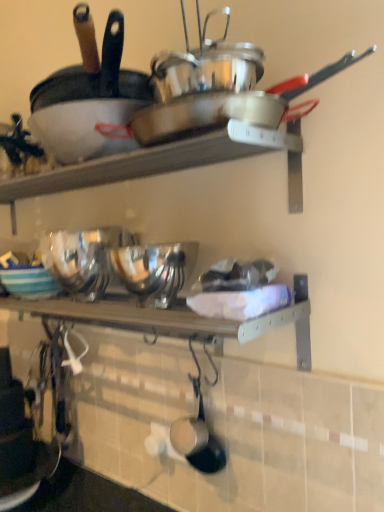
How much space does shiny silver frying pan at lower center, placed as the 2th frying pan when sorted from top to bottom, occupy horizontally?

shiny silver frying pan at lower center, placed as the 2th frying pan when sorted from top to bottom, is 2.37 inches wide.

Where is `shiny silver wok at upper center`? shiny silver wok at upper center is located at coordinates (217, 99).

Measure the distance between shiny silver wok at upper center and camera.

25.85 inches.

The height and width of the screenshot is (512, 384). In order to click on striped ceramic bowl at center in this screenshot , I will do click(29, 282).

Is wooden shelf at center bigger than matte black frying pan at upper left, arranged as the 2th frying pan when ordered from the bottom?

Incorrect, wooden shelf at center is not larger than matte black frying pan at upper left, arranged as the 2th frying pan when ordered from the bottom.

From a real-world perspective, is wooden shelf at center positioned above or below matte black frying pan at upper left, arranged as the 2th frying pan when ordered from the bottom?

wooden shelf at center is situated lower than matte black frying pan at upper left, arranged as the 2th frying pan when ordered from the bottom, in the real world.

Is the surface of wooden shelf at center in direct contact with matte black frying pan at upper left, the 1th frying pan from the top?

No.

How many degrees apart are the facing directions of wooden shelf at center and matte black frying pan at upper left, the 1th frying pan from the top?

2.65 degrees separate the facing orientations of wooden shelf at center and matte black frying pan at upper left, the 1th frying pan from the top.

Is striped ceramic bowl at center positioned with its back to shiny silver wok at upper center?

No, striped ceramic bowl at center's orientation is not away from shiny silver wok at upper center.

Do you think striped ceramic bowl at center is within shiny silver wok at upper center, or outside of it?

striped ceramic bowl at center exists outside the volume of shiny silver wok at upper center.

Are striped ceramic bowl at center and shiny silver wok at upper center making contact?

No, striped ceramic bowl at center is not beside shiny silver wok at upper center.

Image resolution: width=384 pixels, height=512 pixels. I want to click on wok that appears above the striped ceramic bowl at center (from the image's perspective), so click(x=217, y=99).

From the image's perspective, which one is positioned higher, shiny silver frying pan at lower center, placed as the 2th frying pan when sorted from top to bottom, or shiny silver wok at upper center?

shiny silver wok at upper center is shown above in the image.

How far apart are shiny silver frying pan at lower center, placed as the 2th frying pan when sorted from top to bottom, and shiny silver wok at upper center?

26.81 inches.

Consider the image. Looking at their sizes, would you say shiny silver frying pan at lower center, placed as the 2th frying pan when sorted from top to bottom, is wider or thinner than shiny silver wok at upper center?

In the image, shiny silver frying pan at lower center, placed as the 2th frying pan when sorted from top to bottom, appears to be more narrow than shiny silver wok at upper center.

How different are the orientations of shiny silver frying pan at lower center, the 1th frying pan ordered from the bottom, and shiny silver wok at upper center in degrees?

The angular difference between shiny silver frying pan at lower center, the 1th frying pan ordered from the bottom, and shiny silver wok at upper center is 3.93 degrees.

Which point is more forward, (28, 288) or (134, 310)?

Point (134, 310)

Would you consider striped ceramic bowl at center to be distant from wooden shelf at center?

Actually, striped ceramic bowl at center and wooden shelf at center are a little close together.

From a real-world perspective, who is located lower, striped ceramic bowl at center or wooden shelf at center?

In real-world perspective, wooden shelf at center is lower.

Locate an element on the screen. Image resolution: width=384 pixels, height=512 pixels. shelf below the striped ceramic bowl at center (from the image's perspective) is located at coordinates (171, 320).

Is wooden shelf at center facing towards shiny silver wok at upper center?

No, wooden shelf at center is not oriented towards shiny silver wok at upper center.

Is wooden shelf at center next to shiny silver wok at upper center?

No.

Considering the relative sizes of wooden shelf at center and shiny silver wok at upper center in the image provided, is wooden shelf at center smaller than shiny silver wok at upper center?

Yes, wooden shelf at center is smaller than shiny silver wok at upper center.

Is wooden shelf at center located outside shiny silver wok at upper center?

Indeed, wooden shelf at center is completely outside shiny silver wok at upper center.

Which is more to the right, shiny silver frying pan at lower center, placed as the 2th frying pan when sorted from top to bottom, or striped ceramic bowl at center?

shiny silver frying pan at lower center, placed as the 2th frying pan when sorted from top to bottom.

Considering the relative sizes of shiny silver frying pan at lower center, placed as the 2th frying pan when sorted from top to bottom, and striped ceramic bowl at center in the image provided, is shiny silver frying pan at lower center, placed as the 2th frying pan when sorted from top to bottom, bigger than striped ceramic bowl at center?

Incorrect, shiny silver frying pan at lower center, placed as the 2th frying pan when sorted from top to bottom, is not larger than striped ceramic bowl at center.

Can you confirm if shiny silver wok at upper center is taller than matte black frying pan at upper left, the 1th frying pan from the top?

Incorrect, the height of shiny silver wok at upper center is not larger of that of matte black frying pan at upper left, the 1th frying pan from the top.

Looking at this image, are shiny silver wok at upper center and matte black frying pan at upper left, the 1th frying pan from the top, far apart?

No.

From a real-world perspective, is shiny silver wok at upper center below matte black frying pan at upper left, the 1th frying pan from the top?

Yes, from a real-world perspective, shiny silver wok at upper center is below matte black frying pan at upper left, the 1th frying pan from the top.

From the image's perspective, between shiny silver wok at upper center and matte black frying pan at upper left, arranged as the 2th frying pan when ordered from the bottom, which one is located above?

matte black frying pan at upper left, arranged as the 2th frying pan when ordered from the bottom, from the image's perspective.

Find the location of `frying pan in front of the wooden shelf at center`. frying pan in front of the wooden shelf at center is located at coordinates (89, 97).

Where is `wok above the striped ceramic bowl at center (from the image's perspective)`? wok above the striped ceramic bowl at center (from the image's perspective) is located at coordinates (217, 99).

When comparing their distances from striped ceramic bowl at center, does shiny silver frying pan at lower center, placed as the 2th frying pan when sorted from top to bottom, or matte black frying pan at upper left, arranged as the 2th frying pan when ordered from the bottom, seem closer?

matte black frying pan at upper left, arranged as the 2th frying pan when ordered from the bottom, is positioned closer to the anchor striped ceramic bowl at center.

Based on their spatial positions, is wooden shelf at center or striped ceramic bowl at center closer to matte black frying pan at upper left, arranged as the 2th frying pan when ordered from the bottom?

wooden shelf at center lies closer to matte black frying pan at upper left, arranged as the 2th frying pan when ordered from the bottom, than the other object.

Looking at the image, which one is located closer to shiny silver frying pan at lower center, the 1th frying pan ordered from the bottom, striped ceramic bowl at center or matte black frying pan at upper left, arranged as the 2th frying pan when ordered from the bottom?

The object closer to shiny silver frying pan at lower center, the 1th frying pan ordered from the bottom, is striped ceramic bowl at center.

From the image, which object appears to be nearer to wooden shelf at center, shiny silver wok at upper center or striped ceramic bowl at center?

striped ceramic bowl at center.

Based on their spatial positions, is wooden shelf at center or shiny silver wok at upper center further from striped ceramic bowl at center?

The object further to striped ceramic bowl at center is shiny silver wok at upper center.

Looking at the image, which one is located closer to striped ceramic bowl at center, shiny silver wok at upper center or shiny silver frying pan at lower center, placed as the 2th frying pan when sorted from top to bottom?

shiny silver frying pan at lower center, placed as the 2th frying pan when sorted from top to bottom.

Considering their positions, is wooden shelf at center positioned closer to matte black frying pan at upper left, arranged as the 2th frying pan when ordered from the bottom, than shiny silver frying pan at lower center, the 1th frying pan ordered from the bottom?

wooden shelf at center.

Estimate the real-world distances between objects in this image. Which object is closer to striped ceramic bowl at center, matte black frying pan at upper left, the 1th frying pan from the top, or wooden shelf at center?

Among the two, wooden shelf at center is located nearer to striped ceramic bowl at center.

Find the location of a particular element. bowl between shiny silver wok at upper center and shiny silver frying pan at lower center, placed as the 2th frying pan when sorted from top to bottom, from top to bottom is located at coordinates (29, 282).

At what (x,y) coordinates should I click in order to perform the action: click on shelf between shiny silver wok at upper center and shiny silver frying pan at lower center, the 1th frying pan ordered from the bottom, vertically. Please return your answer as a coordinate pair (x, y). The height and width of the screenshot is (512, 384). Looking at the image, I should click on (171, 320).

Find the location of a particular element. wok that lies between matte black frying pan at upper left, arranged as the 2th frying pan when ordered from the bottom, and wooden shelf at center from top to bottom is located at coordinates (217, 99).

Locate an element on the screen. shelf situated between striped ceramic bowl at center and shiny silver frying pan at lower center, the 1th frying pan ordered from the bottom, from left to right is located at coordinates (171, 320).